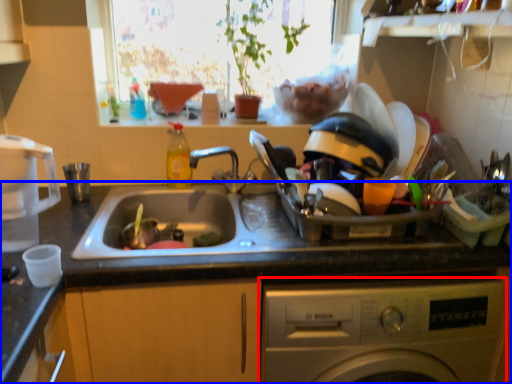
Question: Which of the following is the farthest to the observer, washing machine (highlighted by a red box) or countertop (highlighted by a blue box)?

Choices:
 (A) washing machine
 (B) countertop

Answer: (B)